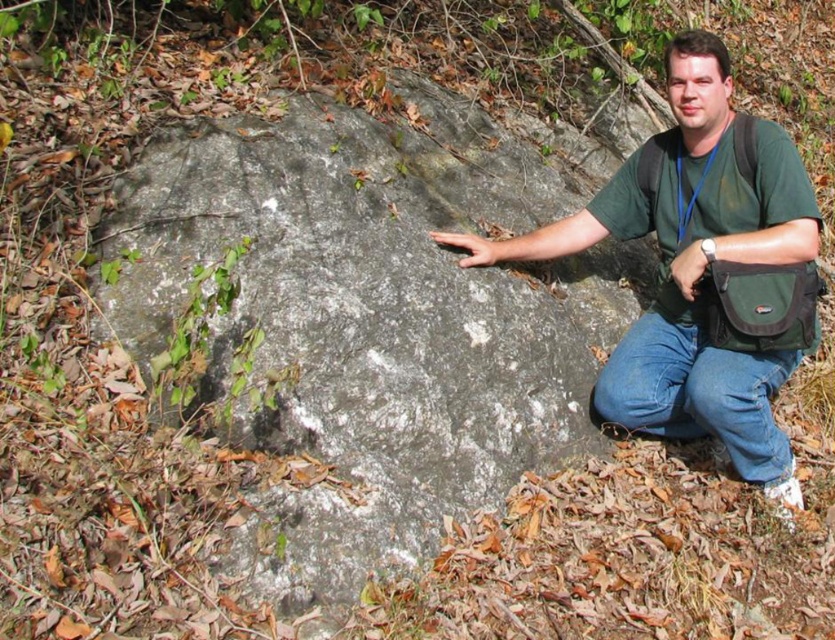
Question: Where is gray rough rock at center located in relation to matte black hand at center in the image?

Choices:
 (A) left
 (B) right

Answer: (A)

Question: Does smooth gray rock at center have a lesser width compared to matte black hand at center?

Choices:
 (A) yes
 (B) no

Answer: (B)

Question: Can you confirm if green fabric bag at center is positioned to the right of smooth gray rock at center?

Choices:
 (A) no
 (B) yes

Answer: (B)

Question: Considering the real-world distances, which object is closest to the matte black hand at center?

Choices:
 (A) green fabric bag at center
 (B) smooth gray rock at center
 (C) denim jeans at lower right
 (D) gray rough rock at center

Answer: (A)

Question: Considering the real-world distances, which object is closest to the green fabric bag at center?

Choices:
 (A) denim jeans at lower right
 (B) gray rough rock at center
 (C) smooth gray rock at center

Answer: (A)

Question: Which point is closer to the camera?

Choices:
 (A) green fabric bag at center
 (B) smooth gray rock at center

Answer: (A)